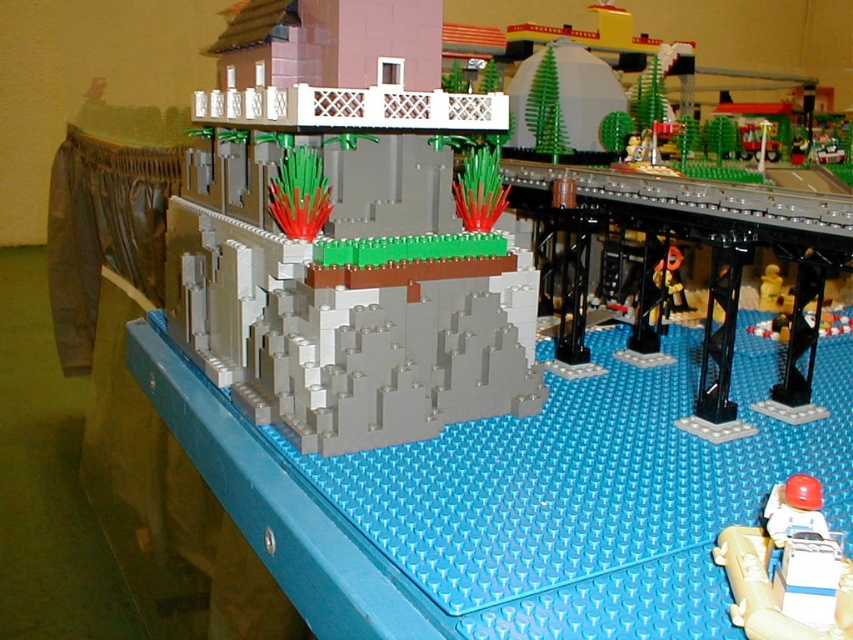
Does gray matte rock formation at center appear on the right side of matte yellow figure at center-right?

In fact, gray matte rock formation at center is to the left of matte yellow figure at center-right.

Is point (268, 131) positioned in front of point (674, 260)?

Yes, it is in front of point (674, 260).

Find the location of `gray matte rock formation at center`. gray matte rock formation at center is located at coordinates (349, 243).

Who is positioned more to the left, white plastic figure at lower right or yellow plastic figure at center-right?

Positioned to the left is white plastic figure at lower right.

Between point (846, 604) and point (779, 275), which one is positioned in front?

Point (846, 604) is more forward.

The image size is (853, 640). I want to click on white plastic figure at lower right, so click(788, 568).

Does white plastic figure at lower right appear under matte yellow figure at center-right?

Correct, white plastic figure at lower right is located below matte yellow figure at center-right.

The height and width of the screenshot is (640, 853). Describe the element at coordinates (788, 568) in the screenshot. I see `white plastic figure at lower right` at that location.

In order to click on white plastic figure at lower right in this screenshot , I will do (x=788, y=568).